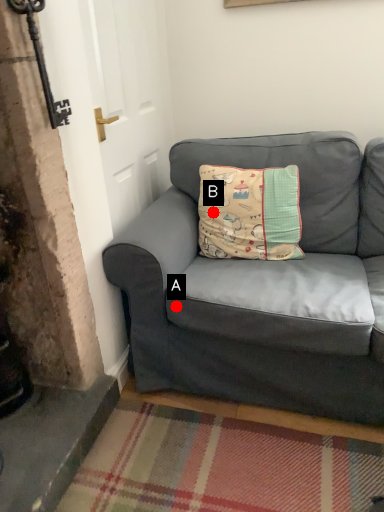
Question: Two points are circled on the image, labeled by A and B beside each circle. Which point is closer to the camera?

Choices:
 (A) A is closer
 (B) B is closer

Answer: (A)